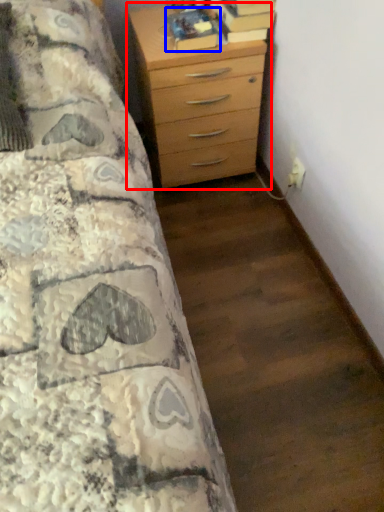
Question: Which object is closer to the camera taking this photo, chest of drawers (highlighted by a red box) or book (highlighted by a blue box)?

Choices:
 (A) chest of drawers
 (B) book

Answer: (A)